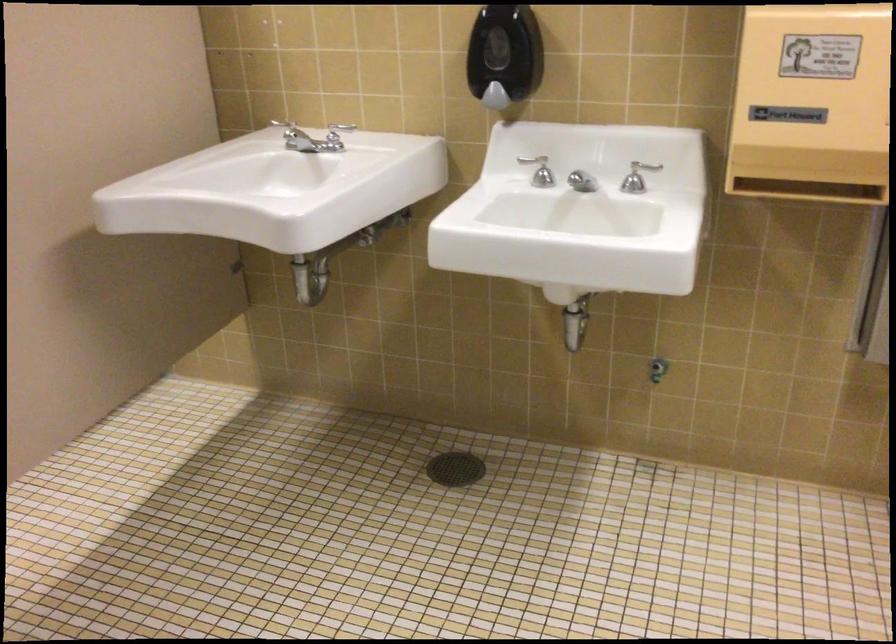
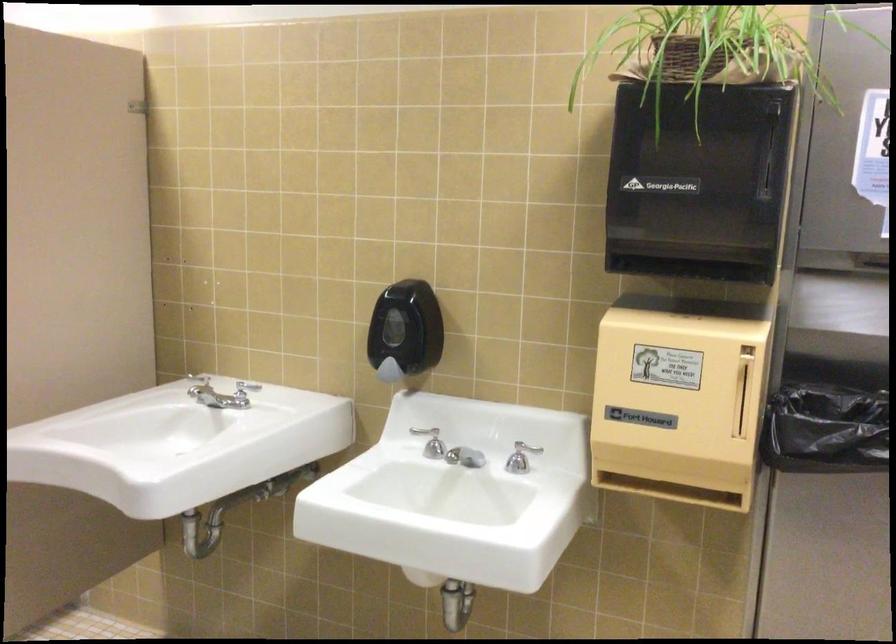
Where in the second image is the point corresponding to pixel 540 175 from the first image?

(433, 444)